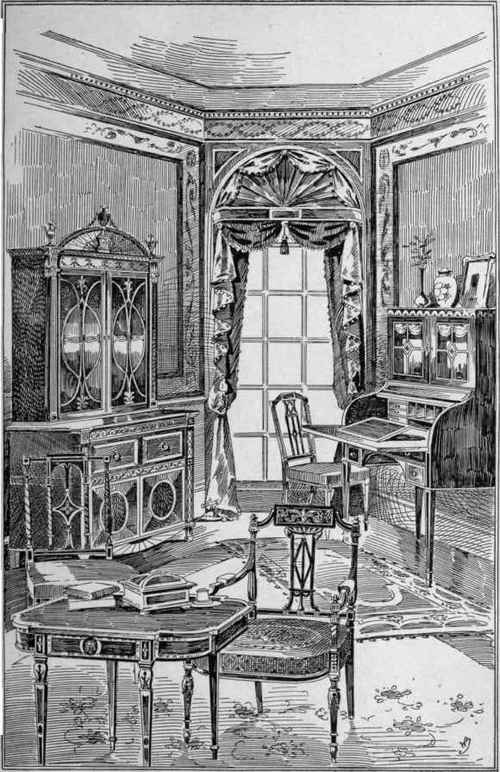
Image resolution: width=500 pixels, height=772 pixels. What are the coordinates of `legs of table` in the screenshot? It's located at [x=147, y=702], [x=44, y=705], [x=109, y=695], [x=184, y=692].